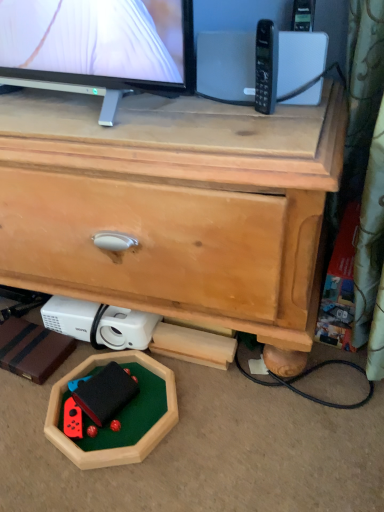
Image resolution: width=384 pixels, height=512 pixels. Identify the location of vacant space situated on the left part of black plastic phone at upper right. (174, 118).